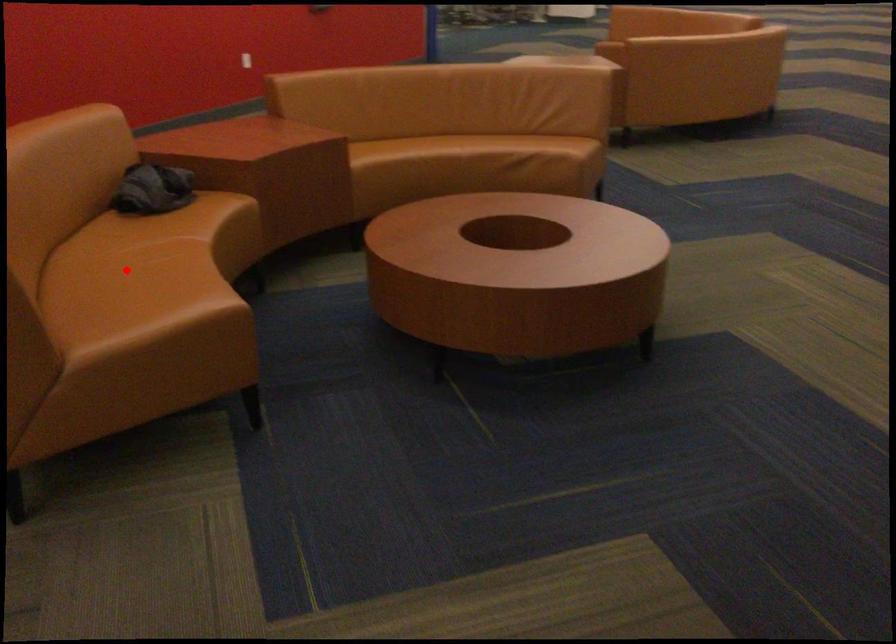
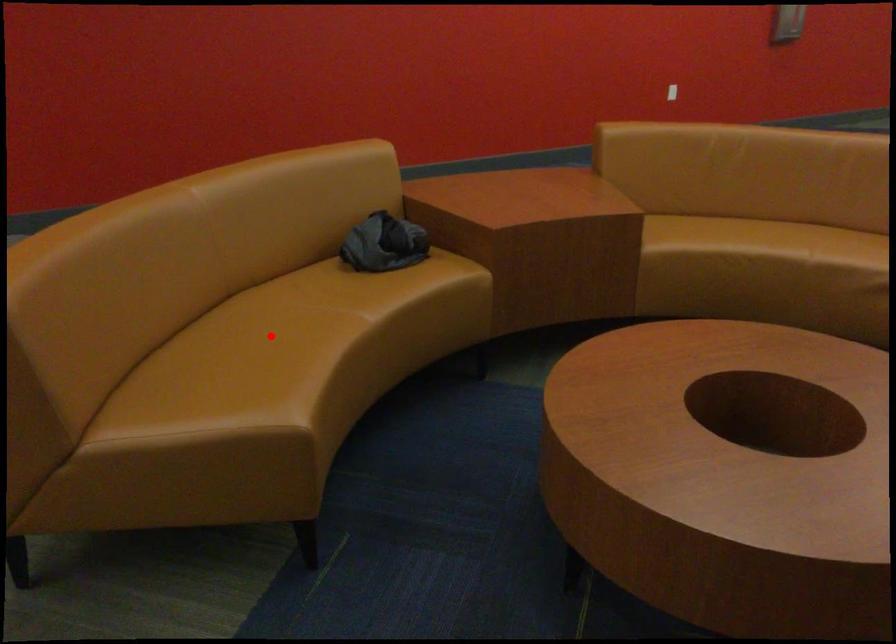
I am providing you with two images of the same scene from different viewpoints. A red point is marked on the first image and another point is marked on the second image. Do the highlighted points in image1 and image2 indicate the same real-world spot?

Yes